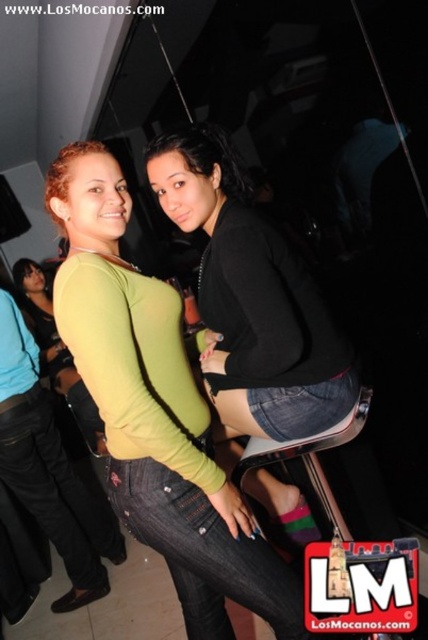
You are organizing a photo album and want to ensure that the green matte shirt at center and the black denim shorts at center are displayed side by side. Given that the album page has a maximum width of 12 inches, can both items fit without overlapping?

The green matte shirt at center is wider than the black denim shorts at center. However, without knowing their exact widths, it is impossible to determine if both can fit within the 12 inch limit. Additional measurements are needed.

Looking at this image, you are at a party and want to take a photo of both the green matte shirt at center and the black denim shorts at center. Which one should you focus on first if you want to capture them both in the frame?

You should focus on the green matte shirt at center first because it is to the left of the black denim shorts at center, so capturing it first ensures both are in the frame.